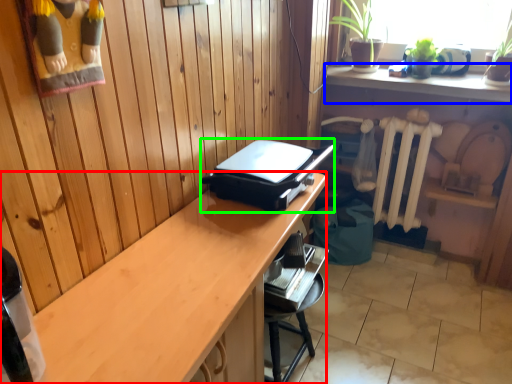
Question: Which object is the farthest from desk (highlighted by a red box)? Choose among these: shelf (highlighted by a blue box) or appliance (highlighted by a green box).

Choices:
 (A) shelf
 (B) appliance

Answer: (A)